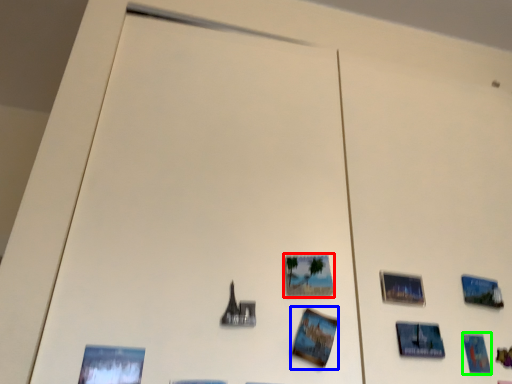
Question: Considering the real-world distances, which object is closest to picture frame (highlighted by a red box)? postcard (highlighted by a blue box) or postcard (highlighted by a green box).

Choices:
 (A) postcard
 (B) postcard

Answer: (A)